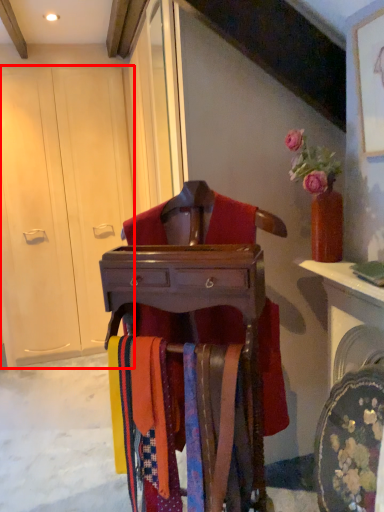
Question: From the image's perspective, where is armoire (annotated by the red box) located relative to furniture?

Choices:
 (A) below
 (B) above

Answer: (B)